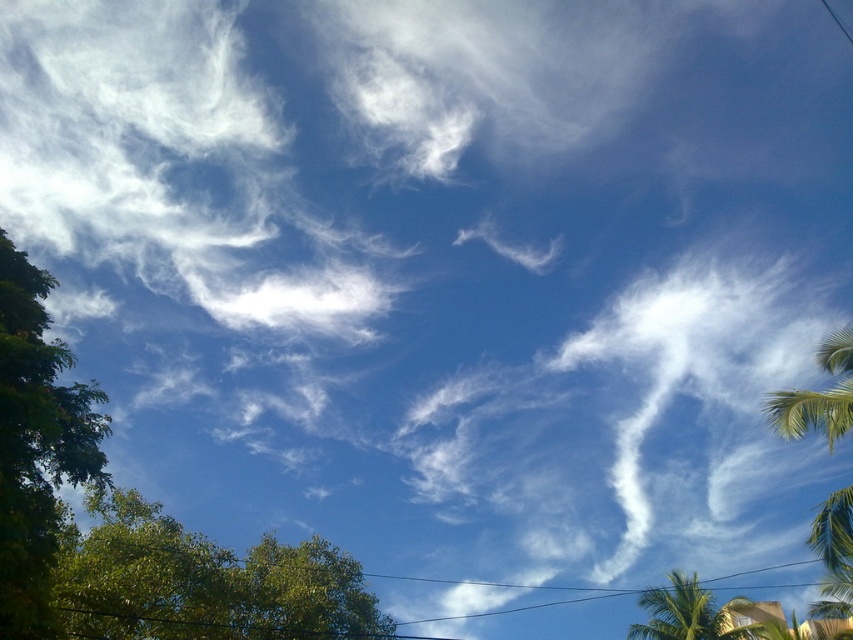
You are standing in the middle of a forest clearing and see a point marked at coordinates (x=202, y=582). Which object in the scene does this point belong to?

The point at coordinates (x=202, y=582) belongs to the green leafy tree at lower left.

You are standing in the middle of a clearing and see the green leafy tree at left and the green leafy palm tree at right. Which tree would you need to look up to see the top of?

The green leafy palm tree at right is taller than the green leafy tree at left, so you would need to look up to see its top.